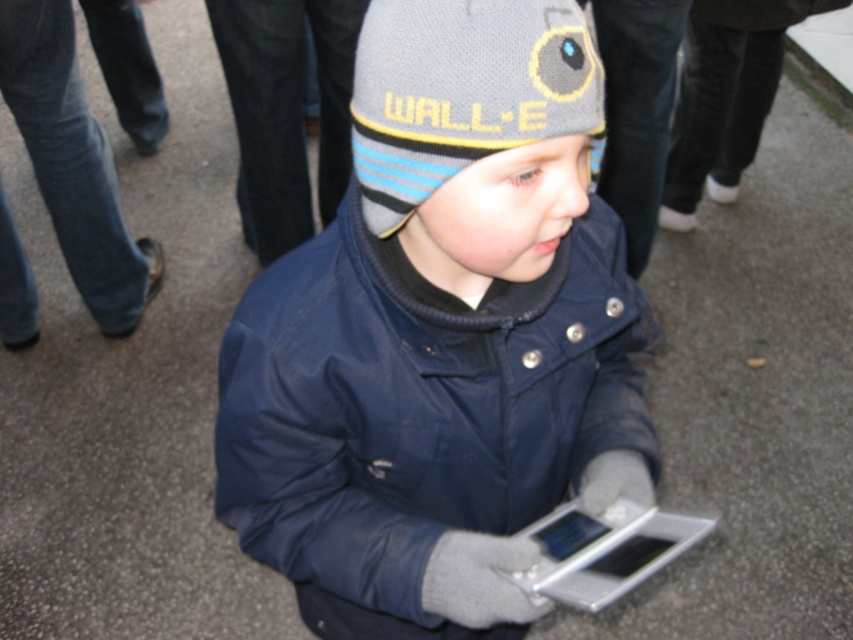
What is the exact coordinate of the matte blue jacket at center?

The matte blue jacket at center is located at point [440,336].

You are a photographer trying to capture a closeup of the gray knitted hat at center and the matte blue jacket at center. Based on their positions, which object should you adjust your camera focus to first to ensure both are in frame?

The gray knitted hat at center is to the left of the matte blue jacket at center, so you should focus on the gray knitted hat at center first to ensure both are in frame.